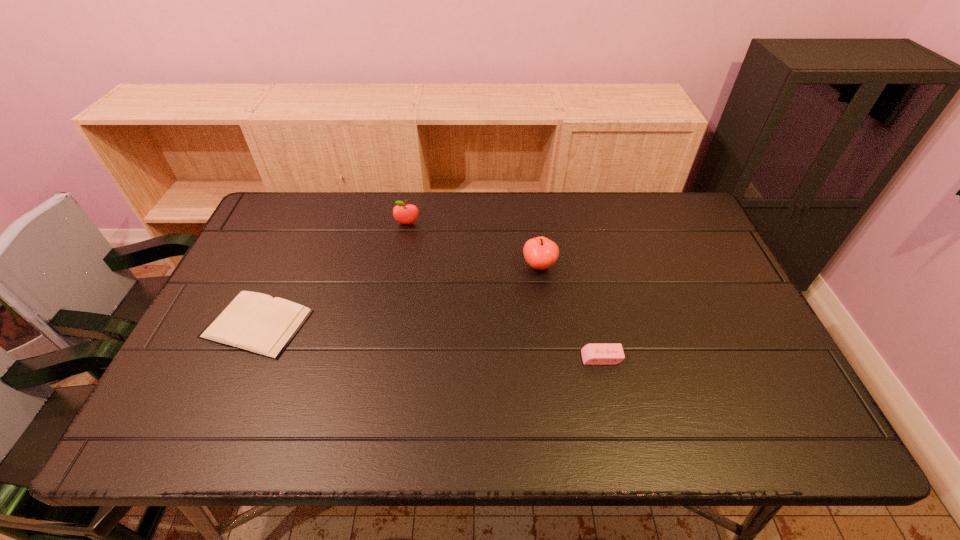
Identify which object is located as the nearest to the farther apple. Please provide its 2D coordinates. Your answer should be formatted as a tuple, i.e. [(x, y)], where the tuple contains the x and y coordinates of a point satisfying the conditions above.

[(255, 322)]

Locate an element on the screen. vacant region that satisfies the following two spatial constraints: 1. on the back side of the hardback book; 2. on the left side of the right apple is located at coordinates (282, 266).

Locate an element on the screen. free space that satisfies the following two spatial constraints: 1. on the front side of the eraser; 2. on the right side of the shortest object is located at coordinates (242, 357).

Identify the location of free spot that satisfies the following two spatial constraints: 1. on the back side of the third object from right to left; 2. on the left side of the leftmost object. The height and width of the screenshot is (540, 960). click(301, 224).